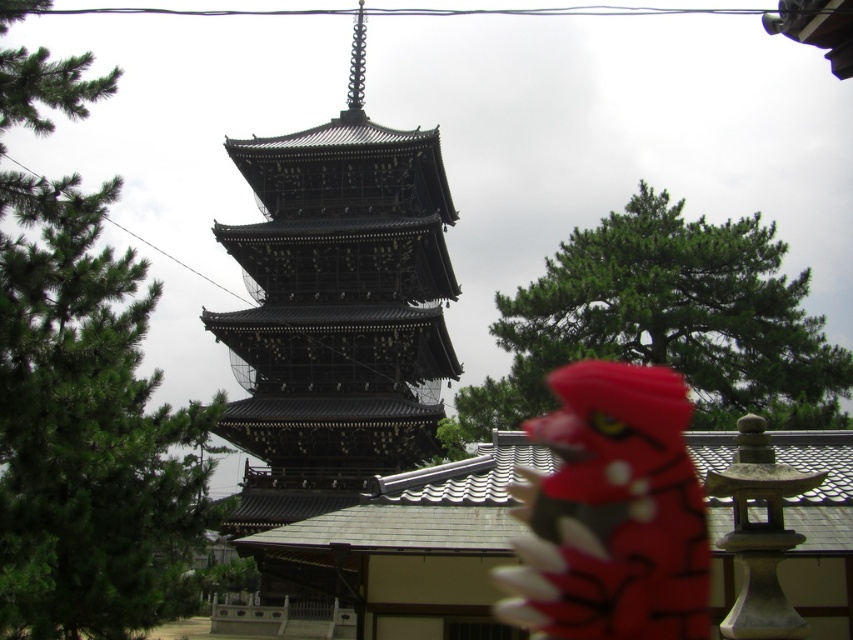
Question: Can you confirm if green matte tree at upper left is positioned to the right of black lacquered pagoda at center?

Choices:
 (A) no
 (B) yes

Answer: (A)

Question: Which object is positioned closest to the green matte tree at upper left?

Choices:
 (A) matte plastic dragon at lower right
 (B) green textured tree at upper center
 (C) black lacquered pagoda at center

Answer: (C)

Question: Does black lacquered pagoda at center appear under green textured tree at upper center?

Choices:
 (A) yes
 (B) no

Answer: (B)

Question: Which object is closer to the camera taking this photo?

Choices:
 (A) matte plastic dragon at lower right
 (B) black lacquered pagoda at center
 (C) green matte tree at upper left
 (D) green textured tree at upper center

Answer: (C)

Question: Which object appears farthest from the camera in this image?

Choices:
 (A) black lacquered pagoda at center
 (B) matte plastic dragon at lower right
 (C) green textured tree at upper center

Answer: (C)

Question: Is black lacquered pagoda at center positioned at the back of matte plastic dragon at lower right?

Choices:
 (A) yes
 (B) no

Answer: (A)